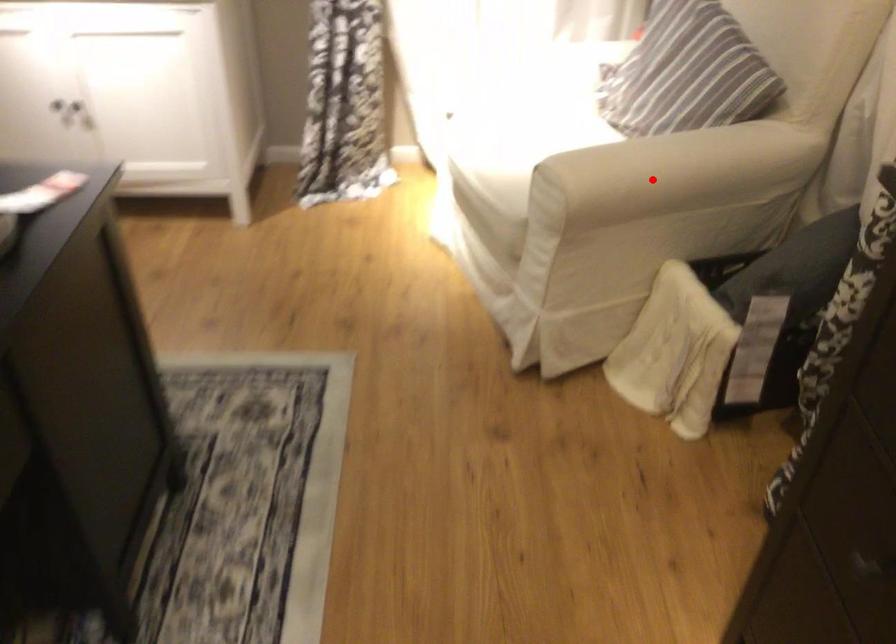
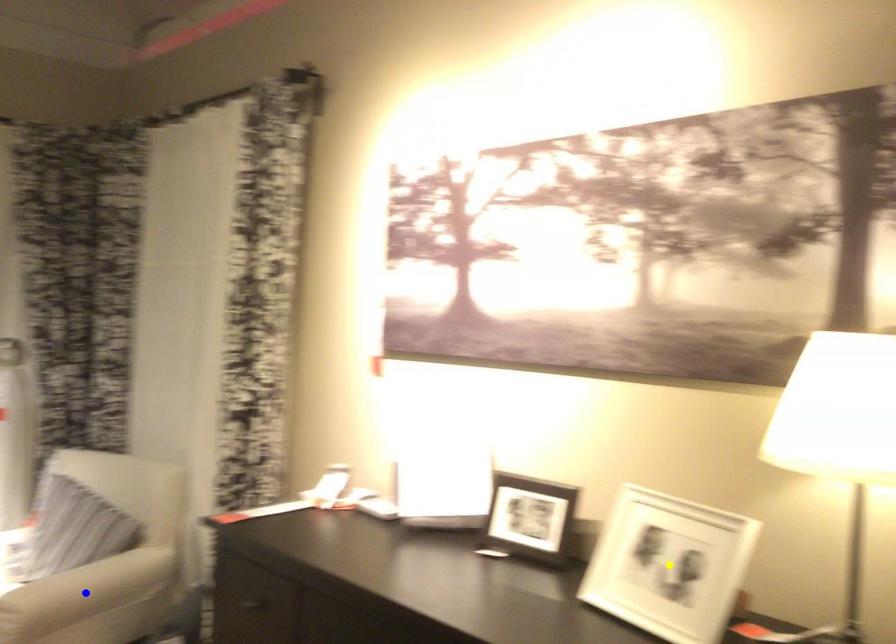
Question: I am providing you with two images of the same scene from different viewpoints. A red point is marked on the first image. You are given multiple points on the second image. Which spot in image 2 lines up with the point in image 1?

Choices:
 (A) green point
 (B) yellow point
 (C) blue point

Answer: (C)